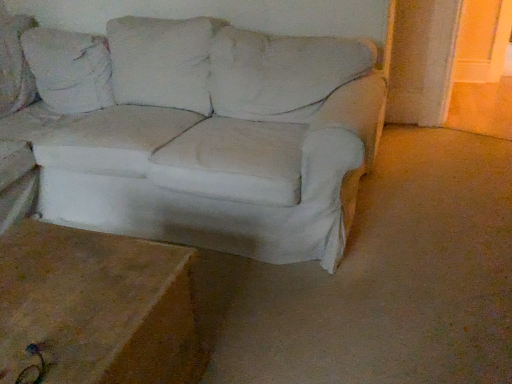
The width and height of the screenshot is (512, 384). What do you see at coordinates (203, 134) in the screenshot?
I see `white fabric couch at center` at bounding box center [203, 134].

At what (x,y) coordinates should I click in order to perform the action: click on white fabric couch at center. Please return your answer as a coordinate pair (x, y). Image resolution: width=512 pixels, height=384 pixels. Looking at the image, I should click on (203, 134).

Image resolution: width=512 pixels, height=384 pixels. What are the coordinates of `brown wood table at lower left` in the screenshot? It's located at (97, 307).

What is the approximate width of brown wood table at lower left?

60.57 centimeters.

What do you see at coordinates (97, 307) in the screenshot? I see `brown wood table at lower left` at bounding box center [97, 307].

Identify the location of white fabric couch at center. (203, 134).

Based on the photo, is white fabric couch at center at the right side of brown wood table at lower left?

Correct, you'll find white fabric couch at center to the right of brown wood table at lower left.

Does white fabric couch at center lie in front of brown wood table at lower left?

No, white fabric couch at center is further to the viewer.

Considering the points (144, 81) and (83, 355), which point is behind, point (144, 81) or point (83, 355)?

The point (144, 81) is behind.

From the image's perspective, between white fabric couch at center and brown wood table at lower left, who is located below?

brown wood table at lower left.

From a real-world perspective, between white fabric couch at center and brown wood table at lower left, who is vertically lower?

brown wood table at lower left.

Which of these two, white fabric couch at center or brown wood table at lower left, is wider?

white fabric couch at center.

Who is taller, white fabric couch at center or brown wood table at lower left?

white fabric couch at center.

Who is bigger, white fabric couch at center or brown wood table at lower left?

Bigger between the two is white fabric couch at center.

Which is correct: white fabric couch at center is inside brown wood table at lower left, or outside of it?

white fabric couch at center cannot be found inside brown wood table at lower left.

Is white fabric couch at center next to brown wood table at lower left and touching it?

No.

Is white fabric couch at center looking in the opposite direction of brown wood table at lower left?

No.

The image size is (512, 384). I want to click on studio couch on the right of the brown wood table at lower left, so click(203, 134).

Considering the positions of objects brown wood table at lower left and white fabric couch at center in the image provided, who is more to the left, brown wood table at lower left or white fabric couch at center?

Positioned to the left is brown wood table at lower left.

Between brown wood table at lower left and white fabric couch at center, which one is positioned behind?

Positioned behind is white fabric couch at center.

Does point (112, 278) come in front of point (55, 69)?

Yes, point (112, 278) is closer to viewer.

From the image's perspective, is brown wood table at lower left located beneath white fabric couch at center?

Indeed, from the image's perspective, brown wood table at lower left is shown beneath white fabric couch at center.

From a real-world perspective, is brown wood table at lower left positioned above or below white fabric couch at center?

Clearly, from a real-world perspective, brown wood table at lower left is below white fabric couch at center.

Is brown wood table at lower left thinner than white fabric couch at center?

Correct, the width of brown wood table at lower left is less than that of white fabric couch at center.

Does brown wood table at lower left have a greater height compared to white fabric couch at center?

No.

Can you confirm if brown wood table at lower left is bigger than white fabric couch at center?

No, brown wood table at lower left is not bigger than white fabric couch at center.

Is brown wood table at lower left surrounding white fabric couch at center?

No, white fabric couch at center is not surrounded by brown wood table at lower left.

Consider the image. Would you say brown wood table at lower left is a long distance from white fabric couch at center?

That's not correct — brown wood table at lower left is a little close to white fabric couch at center.

Is brown wood table at lower left facing away from white fabric couch at center?

No, brown wood table at lower left is not facing away from white fabric couch at center.

How many degrees apart are the facing directions of brown wood table at lower left and white fabric couch at center?

There is a 91.2-degree angle between the facing directions of brown wood table at lower left and white fabric couch at center.

I want to click on table below the white fabric couch at center (from a real-world perspective), so click(97, 307).

Locate an element on the screen. This screenshot has width=512, height=384. table located below the white fabric couch at center (from the image's perspective) is located at coordinates (97, 307).

Where is `table lying in front of the white fabric couch at center`? The height and width of the screenshot is (384, 512). table lying in front of the white fabric couch at center is located at coordinates (97, 307).